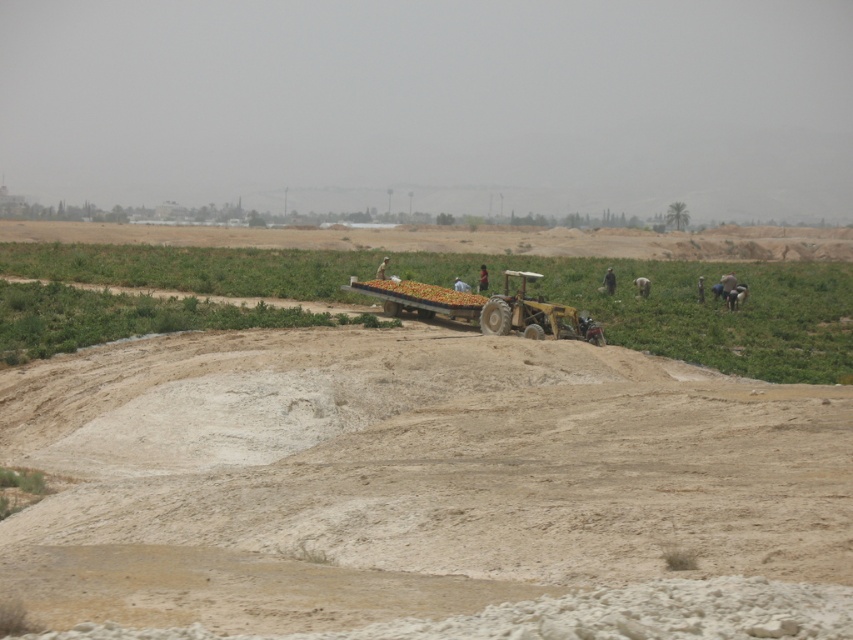
Question: Among these points, which one is nearest to the camera?

Choices:
 (A) (816, 500)
 (B) (532, 305)

Answer: (A)

Question: Which object appears closest to the camera in this image?

Choices:
 (A) light brown sandy at center
 (B) metallic trailer truck at center

Answer: (A)

Question: Is light brown sandy at center to the right of metallic trailer truck at center from the viewer's perspective?

Choices:
 (A) yes
 (B) no

Answer: (B)

Question: Is light brown sandy at center closer to the viewer compared to metallic trailer truck at center?

Choices:
 (A) no
 (B) yes

Answer: (B)

Question: Is light brown sandy at center behind metallic trailer truck at center?

Choices:
 (A) no
 (B) yes

Answer: (A)